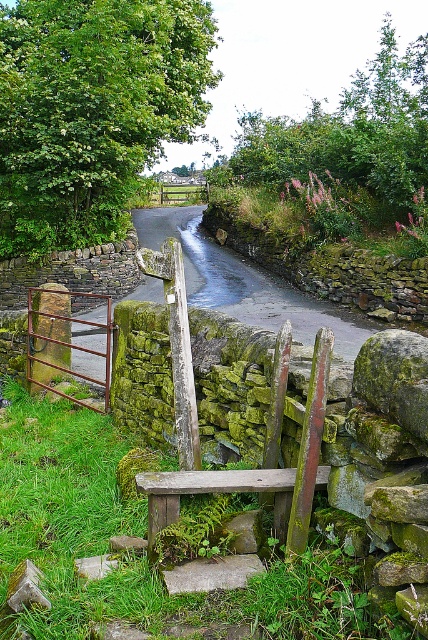
Question: Estimate the real-world distances between objects in this image. Which object is closer to the green leafy tree at upper left?

Choices:
 (A) brown wooden fence at center
 (B) smooth concrete path at center
 (C) rusty metal gate at left

Answer: (B)

Question: Is green leafy tree at upper center to the left of brown wooden fence at center from the viewer's perspective?

Choices:
 (A) no
 (B) yes

Answer: (A)

Question: Does green leafy tree at upper center lie in front of brown wooden fence at center?

Choices:
 (A) yes
 (B) no

Answer: (A)

Question: Which object is positioned closest to the green mossy stone at lower left?

Choices:
 (A) rusty metal gate at left
 (B) green leafy tree at upper left

Answer: (A)

Question: Based on their relative distances, which object is farther from the smooth concrete path at center?

Choices:
 (A) brown wooden fence at center
 (B) rusty metal gate at left
 (C) green mossy stone at lower left

Answer: (C)

Question: Can you confirm if green leafy tree at upper left is smaller than rusty metal gate at left?

Choices:
 (A) yes
 (B) no

Answer: (A)